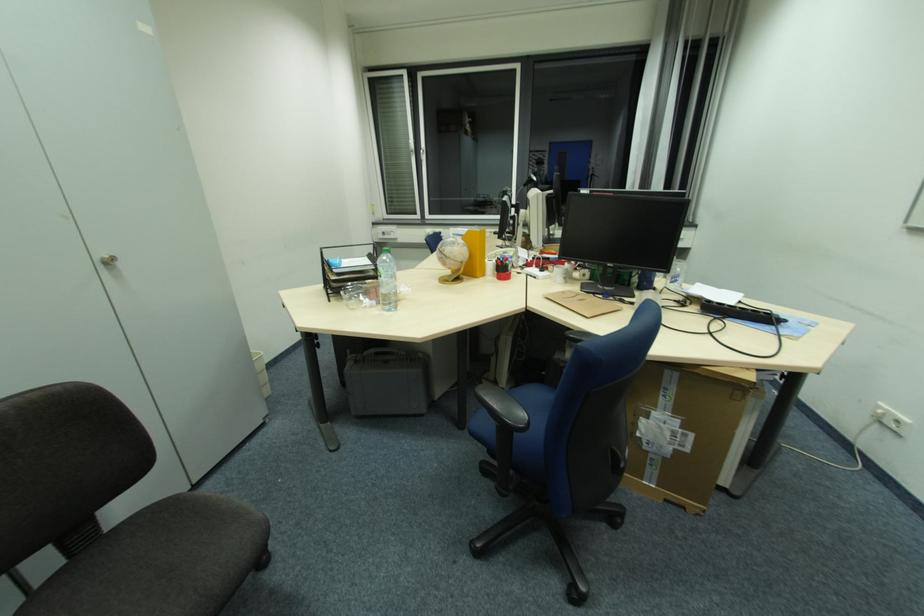
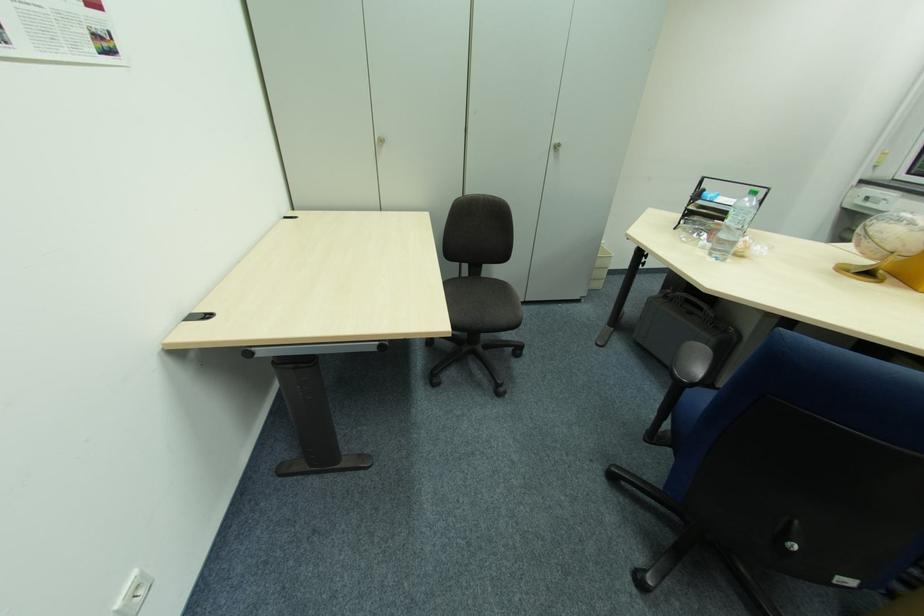
Locate, in the second image, the point that corresponds to point 395,277 in the first image.

(743, 224)